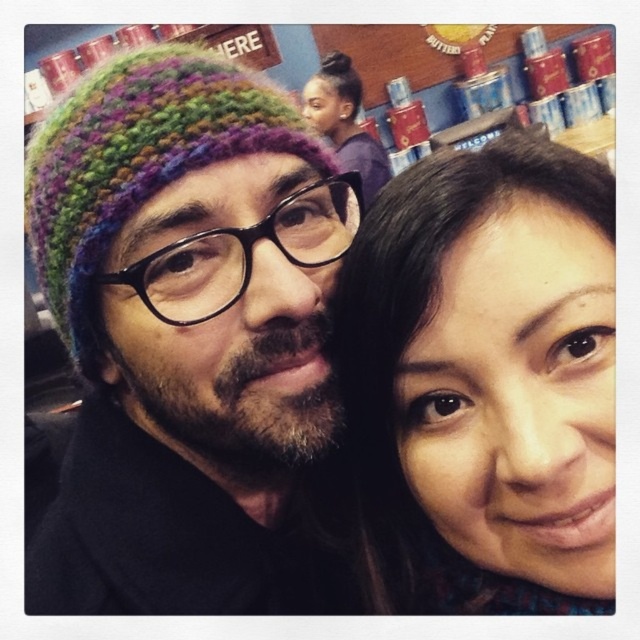
You are a photographer trying to capture a close shot of both the multicolored knitted hat at left and the smooth brown hair at center in the same frame. Given that your camera lens has a maximum focus range of 5 inches, will you be able to capture both objects clearly in the photo?

The multicolored knitted hat at left and smooth brown hair at center are 4.81 inches apart from each other. Since the distance between them is within the camera lens maximum focus range of 5 inches, both objects can be captured clearly in the photo.

You are designing a display for a hat shop and need to arrange the multicolored knitted hat at left and the purple knit beanie at upper center on a shelf. Based on their sizes, which hat should be placed in the front to ensure both are visible?

The multicolored knitted hat at left should be placed in front since it is smaller than the purple knit beanie at upper center, allowing both to be visible without blocking each other.

You are standing in front of the shelves in the store and want to reach two points marked on the shelves. The first point is at coordinates point [568,465] and the second is at point [352,77]. Which point should you reach first if you want to touch them in order from closest to farthest?

Point [568,465] is closer to the viewer than point [352,77], so you should reach point [568,465] first.